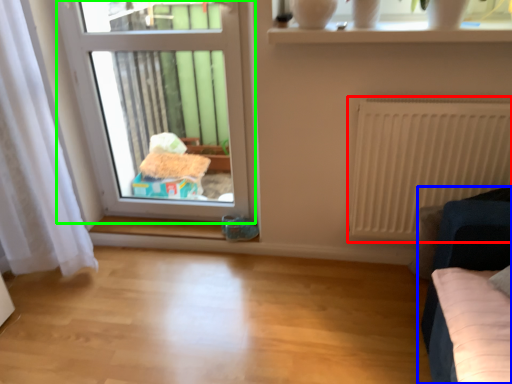
Question: Which object is positioned closest to radiator (highlighted by a red box)? Select from furniture (highlighted by a blue box) and window (highlighted by a green box).

Choices:
 (A) furniture
 (B) window

Answer: (A)